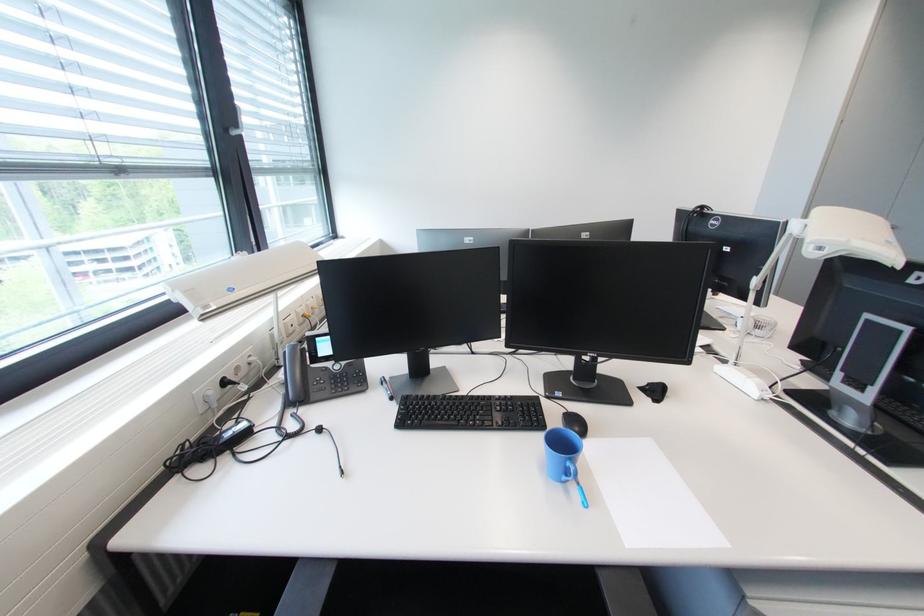
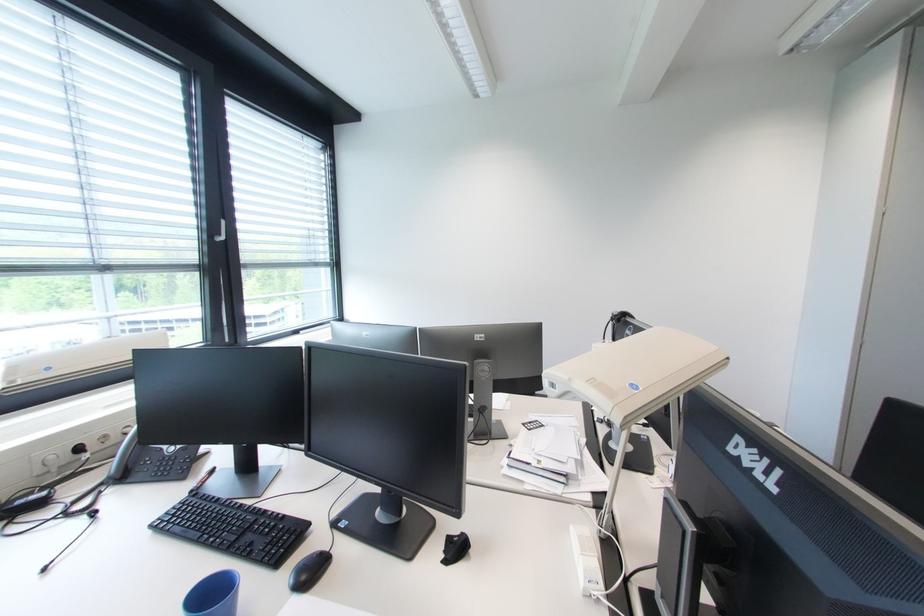
Locate, in the second image, the point that corresponds to [517,398] in the first image.

(290, 517)